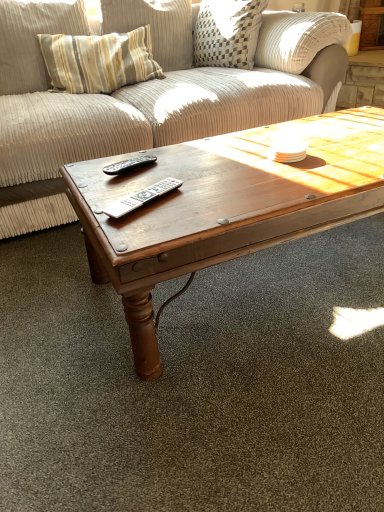
At what (x,y) coordinates should I click in order to perform the action: click on vacant space that is to the left of silver metallic remote at center, placed as the first remote when sorted from front to back. Please return your answer as a coordinate pair (x, y). Image resolution: width=384 pixels, height=512 pixels. Looking at the image, I should click on (90, 197).